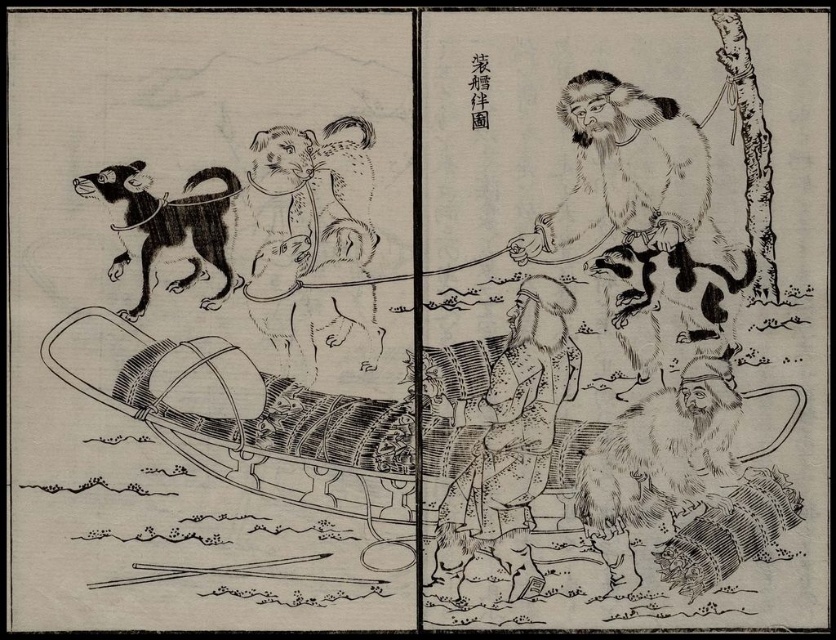
Question: Does fur coat at center appear over furry brown dog at lower right?

Choices:
 (A) no
 (B) yes

Answer: (B)

Question: Is furry brown dog at lower right below black fur cat at upper left?

Choices:
 (A) yes
 (B) no

Answer: (A)

Question: Which object appears farthest from the camera in this image?

Choices:
 (A) black fur cat at upper left
 (B) fur coat at center
 (C) fluffy fur skunk at center
 (D) furry brown dog at lower right

Answer: (C)

Question: Is furry black dog at upper right in front of furry brown dog at lower right?

Choices:
 (A) no
 (B) yes

Answer: (A)

Question: Which of the following is the farthest from the observer?

Choices:
 (A) coord(614,328)
 (B) coord(125,260)

Answer: (A)

Question: Considering the real-world distances, which object is farthest from the fur coat at center?

Choices:
 (A) furry brown dog at lower right
 (B) furry black dog at upper right
 (C) fluffy fur skunk at center
 (D) black fur cat at upper left

Answer: (D)